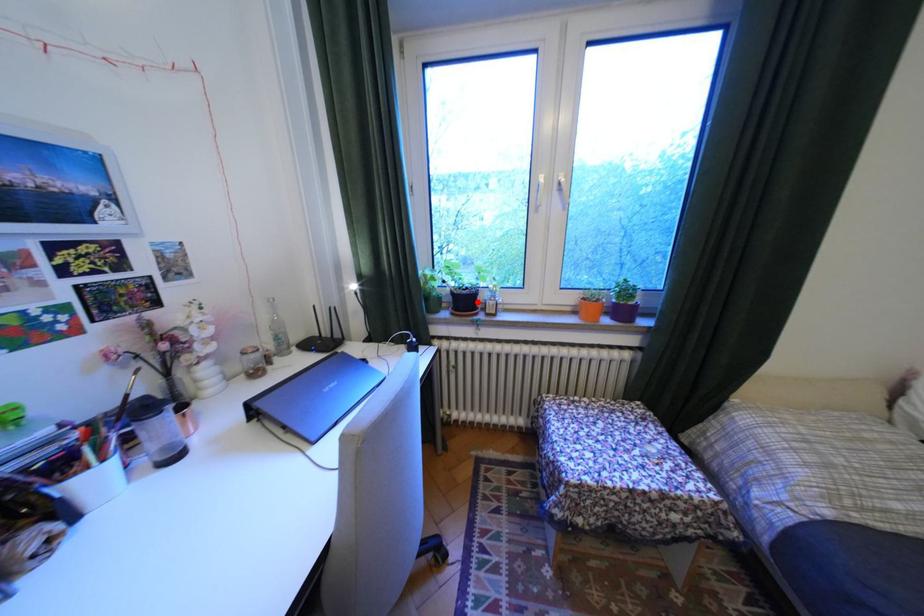
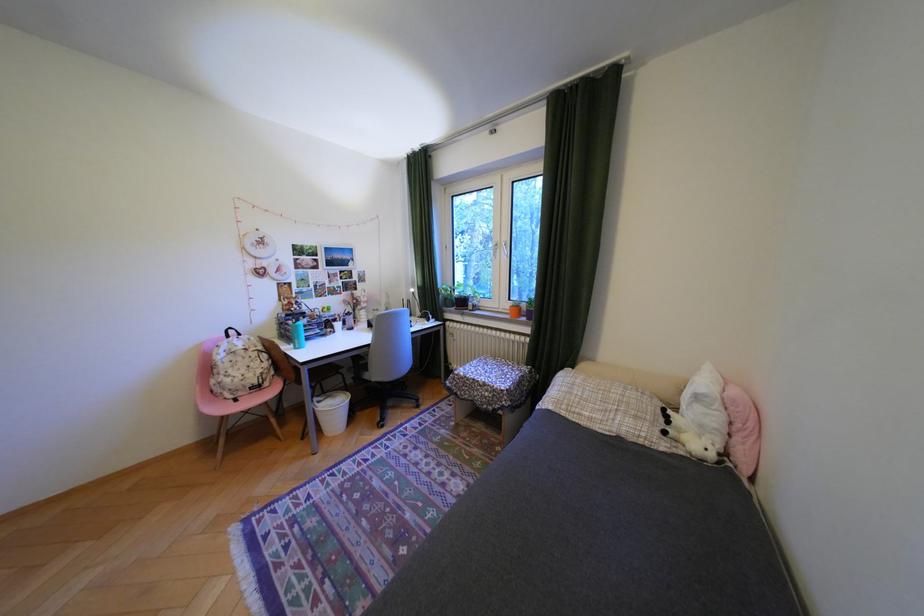
Question: I am providing you with two images of the same scene from different viewpoints. A red point is marked on the first image. Can you still see the location of the red point in image 2?

Choices:
 (A) Yes
 (B) No

Answer: (A)